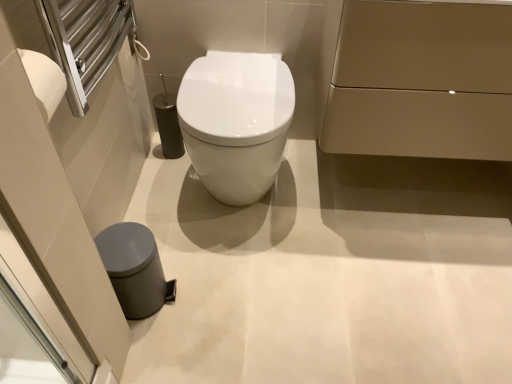
Question: Considering the positions of matte gold cabinet at upper right, positioned as the 1th porcelain in right-to-left order, and white glossy toilet at center in the image, is matte gold cabinet at upper right, positioned as the 1th porcelain in right-to-left order, wider or thinner than white glossy toilet at center?

Choices:
 (A) wide
 (B) thin

Answer: (B)

Question: Relative to white glossy toilet at center, is matte gold cabinet at upper right, acting as the 1th porcelain starting from the top, in front or behind?

Choices:
 (A) behind
 (B) front

Answer: (B)

Question: Based on their relative distances, which object is farther from the gray matte trash can at lower left, the 1th porcelain viewed from the left?

Choices:
 (A) white glossy toilet at center
 (B) matte gold cabinet at upper right, acting as the 1th porcelain starting from the top

Answer: (B)

Question: Based on their relative distances, which object is nearer to the gray matte trash can at lower left, which is the 1th porcelain from bottom to top?

Choices:
 (A) matte gold cabinet at upper right, acting as the second porcelain starting from the bottom
 (B) white glossy toilet at center

Answer: (B)